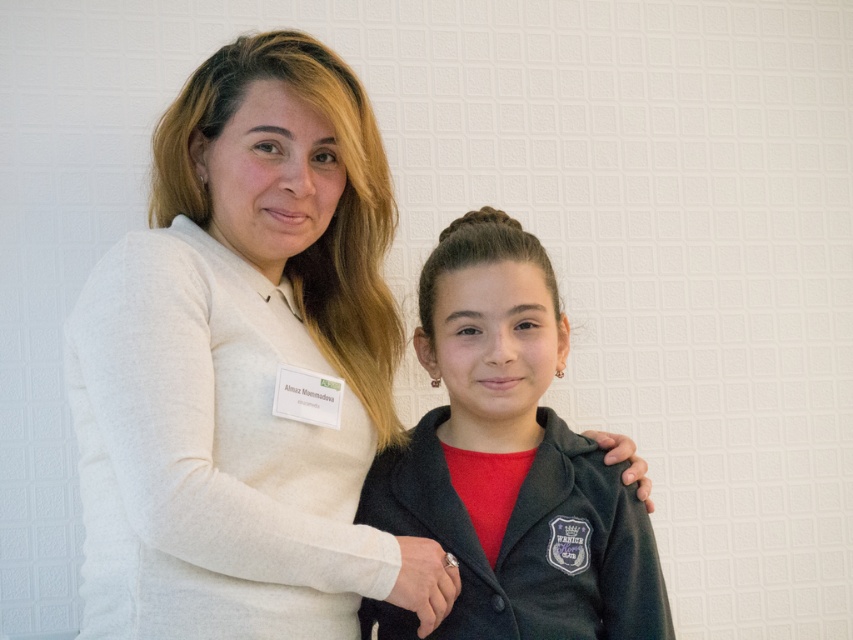
Question: Is white soft sweater at upper left below matte black jacket at center?

Choices:
 (A) no
 (B) yes

Answer: (A)

Question: Which object appears farthest from the camera in this image?

Choices:
 (A) matte black jacket at center
 (B) white soft sweater at upper left

Answer: (A)

Question: Is white soft sweater at upper left thinner than matte black jacket at center?

Choices:
 (A) yes
 (B) no

Answer: (B)

Question: Which object appears closest to the camera in this image?

Choices:
 (A) white soft sweater at upper left
 (B) matte black jacket at center

Answer: (A)

Question: From the image, what is the correct spatial relationship of white soft sweater at upper left in relation to matte black jacket at center?

Choices:
 (A) left
 (B) right

Answer: (A)